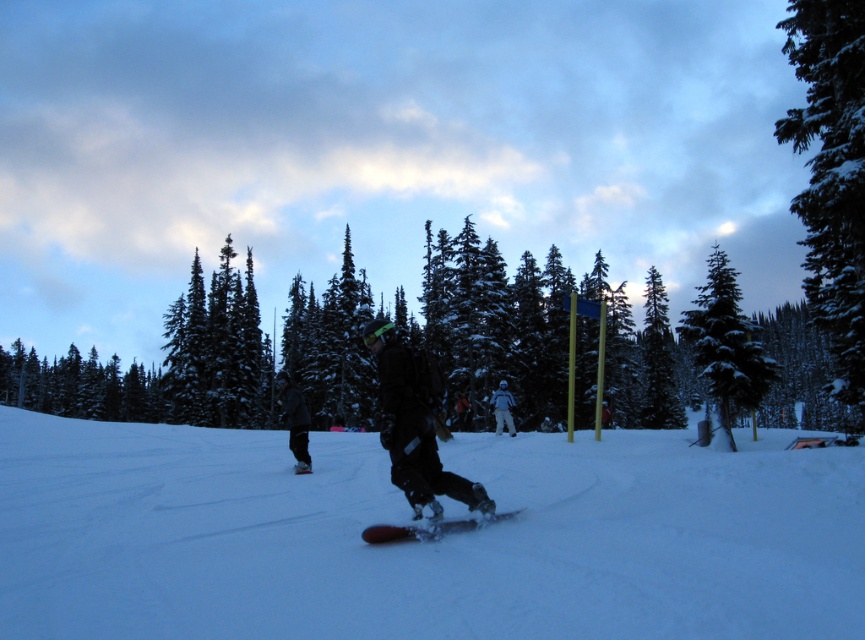
You are a photographer trying to capture both the dark matte snowboarder at center and the white matte snowboarder at center in the same frame. Which snowboarder should you position closer to the left side of your camera viewfinder to ensure both are visible?

You should position the dark matte snowboarder at center closer to the left side of your camera viewfinder since it is already to the left of the white matte snowboarder at center in the scene.

You are standing at the center of the snowy landscape and want to take a photo of the green matte tree at upper left. In which direction should you point your camera?

You should point your camera towards the upper left direction to capture the green matte tree at upper left, as it is located at point (81,387).

You are a photographer trying to capture both the dark matte snowboarder at center and the white matte snowboarder at center in a single shot. Which one will appear closer to the camera in the photo?

The dark matte snowboarder at center will appear closer to the camera because it is positioned in front of the white matte snowboarder at center.